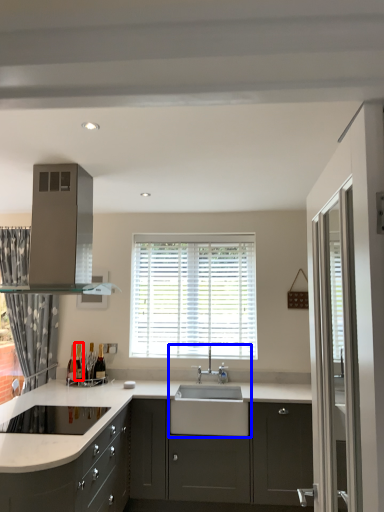
Question: Among these objects, which one is farthest to the camera, wine bottle (highlighted by a red box) or sink (highlighted by a blue box)?

Choices:
 (A) wine bottle
 (B) sink

Answer: (A)